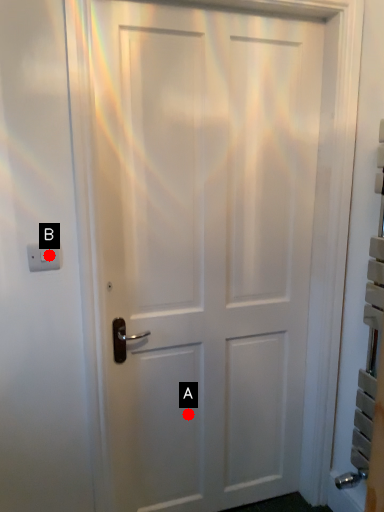
Question: Two points are circled on the image, labeled by A and B beside each circle. Among these points, which one is farthest from the camera?

Choices:
 (A) A is further
 (B) B is further

Answer: (A)